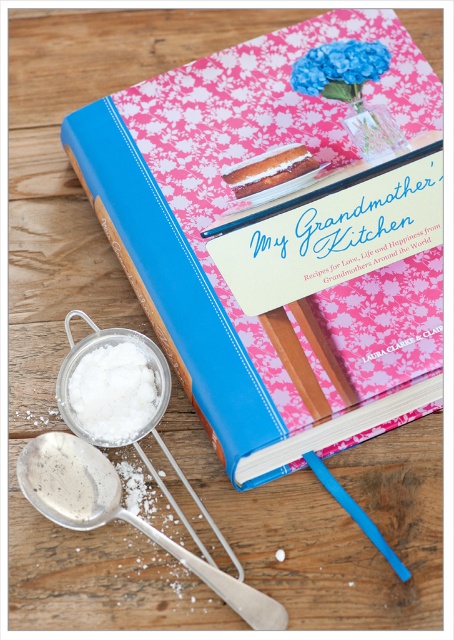
Question: In this image, where is blue hardcover book at center located relative to silver metallic spoon at lower left?

Choices:
 (A) right
 (B) left

Answer: (A)

Question: Which point is farther from the camera taking this photo?

Choices:
 (A) (144, 410)
 (B) (330, 65)
 (C) (202, 566)

Answer: (B)

Question: Which object is farther from the camera taking this photo?

Choices:
 (A) white powdery substance at lower left
 (B) blue hardcover book at center
 (C) blue fabric flower at upper center

Answer: (C)

Question: Based on their relative distances, which object is farther from the blue hardcover book at center?

Choices:
 (A) white powdery substance at lower left
 (B) blue fabric flower at upper center
 (C) silver metallic spoon at lower left

Answer: (C)

Question: Is blue hardcover book at center below blue fabric flower at upper center?

Choices:
 (A) yes
 (B) no

Answer: (A)

Question: Can you confirm if blue hardcover book at center is bigger than white powdery substance at lower left?

Choices:
 (A) no
 (B) yes

Answer: (B)